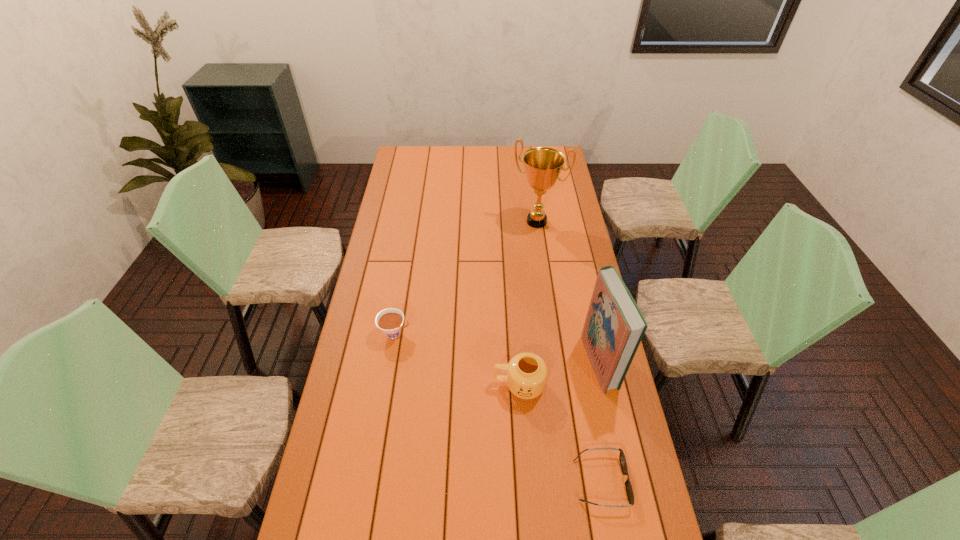
Find the location of a particular element. The image size is (960, 540). free space located on the front view with handles of the award is located at coordinates point(519,253).

The width and height of the screenshot is (960, 540). What are the coordinates of `free region located 0.210m on the front view with handles of the award` in the screenshot? It's located at (515, 264).

Locate an element on the screen. This screenshot has height=540, width=960. free space located 0.250m on the handle side of the third tallest object is located at coordinates (419, 374).

The image size is (960, 540). In order to click on free location located on the handle side of the third tallest object in this screenshot , I will do `click(445, 377)`.

Where is `vacant space positioned 0.280m on the handle side of the third tallest object`? This screenshot has height=540, width=960. vacant space positioned 0.280m on the handle side of the third tallest object is located at coordinates click(x=410, y=373).

At what (x,y) coordinates should I click in order to perform the action: click on free region located on the cover of the hardback book. Please return your answer as a coordinate pair (x, y). Looking at the image, I should click on (516, 378).

This screenshot has width=960, height=540. Identify the location of vacant space located 0.240m on the cover of the hardback book. (518, 378).

I want to click on blank space located on the cover of the hardback book, so click(x=567, y=370).

This screenshot has height=540, width=960. I want to click on object that is positioned at the near edge, so click(x=629, y=490).

This screenshot has height=540, width=960. Find the location of `object positioned at the left edge`. object positioned at the left edge is located at coordinates (390, 320).